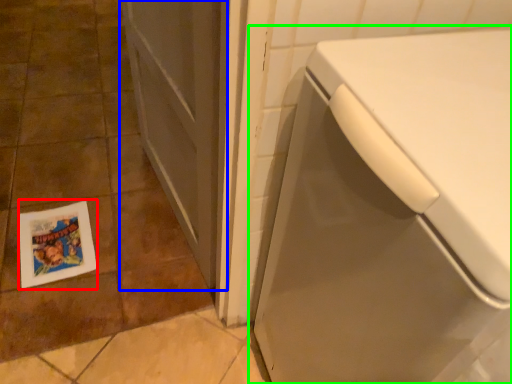
Question: Based on their relative distances, which object is farther from flyer (highlighted by a red box)? Choose from screen door (highlighted by a blue box) and washing machine (highlighted by a green box).

Choices:
 (A) screen door
 (B) washing machine

Answer: (B)